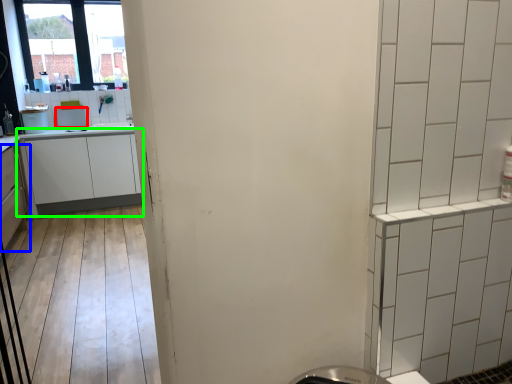
Question: Considering the real-world distances, which object is farthest from appliance (highlighted by a red box)? cabinetry (highlighted by a blue box) or cabinetry (highlighted by a green box)?

Choices:
 (A) cabinetry
 (B) cabinetry

Answer: (A)